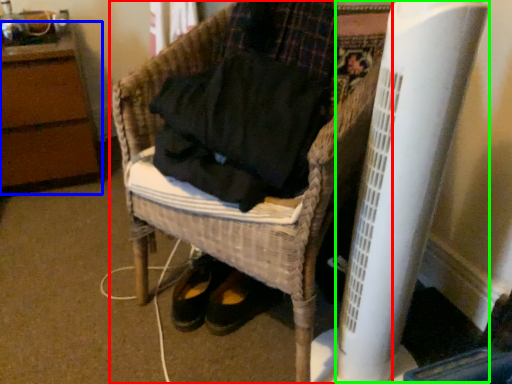
Question: Which object is positioned farthest from furniture (highlighted by a red box)? Select from furniture (highlighted by a blue box) and radiator (highlighted by a green box).

Choices:
 (A) furniture
 (B) radiator

Answer: (A)